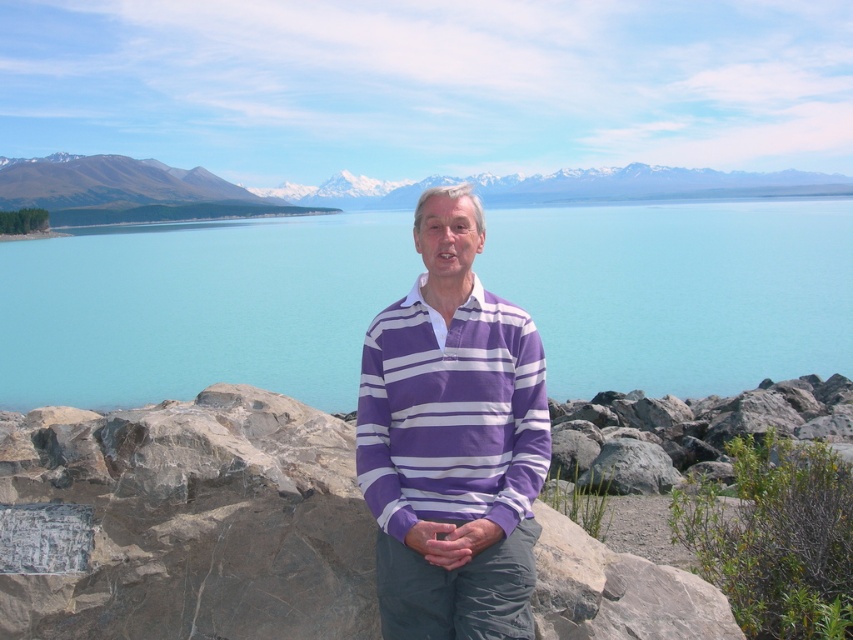
Is turquoise water at center shorter than white snow-covered mountain at upper center?

In fact, turquoise water at center may be taller than white snow-covered mountain at upper center.

Can you confirm if turquoise water at center is bigger than white snow-covered mountain at upper center?

Indeed, turquoise water at center has a larger size compared to white snow-covered mountain at upper center.

Where is `turquoise water at center`? turquoise water at center is located at coordinates (196, 308).

Locate an element on the screen. The width and height of the screenshot is (853, 640). turquoise water at center is located at coordinates (196, 308).

Can you confirm if turquoise water at center is wider than purple striped sweater at center?

Yes.

Where is `turquoise water at center`? turquoise water at center is located at coordinates (196, 308).

Between purple striped sweater at center and white snow-covered mountain at upper center, which one appears on the left side from the viewer's perspective?

purple striped sweater at center

Is point (463, 321) more distant than point (740, 188)?

No, it is in front of (740, 188).

Identify the location of purple striped sweater at center. (451, 440).